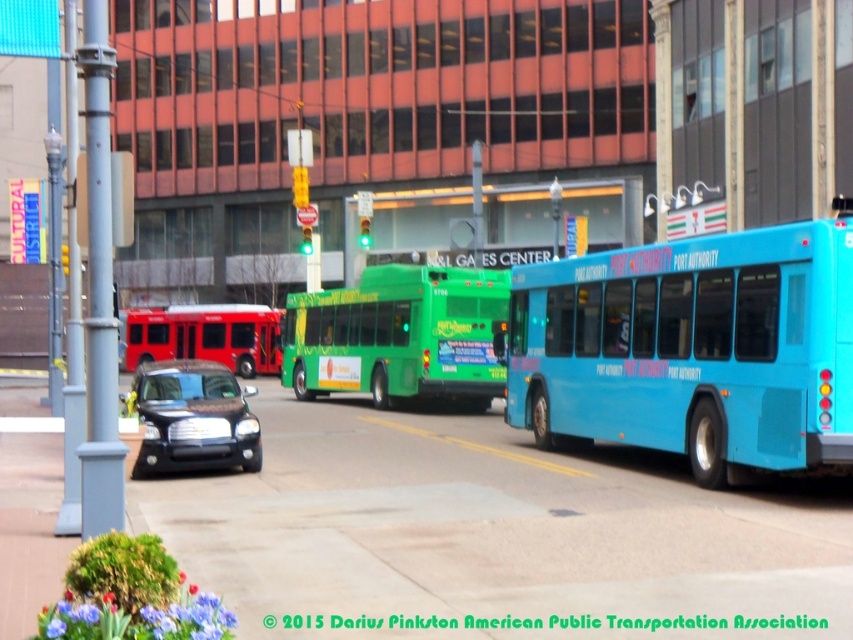
Is green matte bus at center closer to camera compared to satin black sedan at center?

No, it is behind satin black sedan at center.

Is point (483, 275) closer to viewer compared to point (142, 406)?

No, (483, 275) is behind (142, 406).

Who is more forward, [440,289] or [245,416]?

Positioned in front is point [245,416].

Where is `green matte bus at center`? green matte bus at center is located at coordinates (398, 336).

Measure the distance from satin black sedan at center to metallic red bus at left.

They are 8.55 meters apart.

Who is shorter, satin black sedan at center or metallic red bus at left?

With less height is satin black sedan at center.

Is point (218, 461) positioned before point (202, 323)?

Yes, it is in front of point (202, 323).

I want to click on satin black sedan at center, so click(193, 419).

Does blue rubber bus at right appear on the right side of satin black sedan at center?

Yes, blue rubber bus at right is to the right of satin black sedan at center.

In order to click on blue rubber bus at right in this screenshot , I will do `click(693, 349)`.